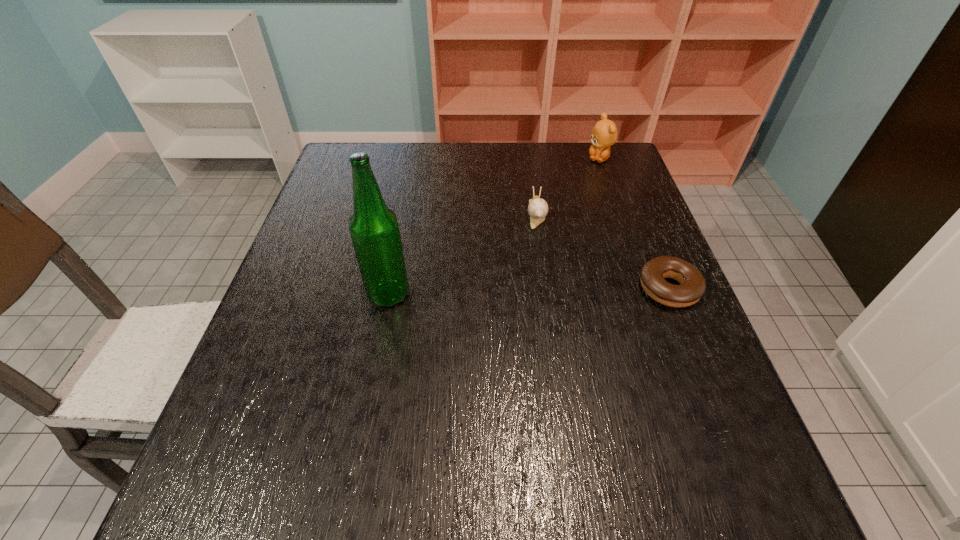
Identify the location of object that is at the far right corner. This screenshot has height=540, width=960. (604, 134).

You are a GUI agent. You are given a task and a screenshot of the screen. Output one action in this format:
    pyautogui.click(x=<x>, y=<y>)
    Task: Click on the vacant area at the far edge of the desktop
    
    Given the screenshot: What is the action you would take?
    pyautogui.click(x=391, y=155)

Identify the location of vacant region at the left edge of the desktop. (311, 232).

In the image, there is a desktop. What are the coordinates of `vacant region at the right edge` in the screenshot? It's located at (609, 285).

You are a GUI agent. You are given a task and a screenshot of the screen. Output one action in this format:
    pyautogui.click(x=<x>, y=<y>)
    Task: Click on the vacant space at the far left corner of the desktop
    
    Given the screenshot: What is the action you would take?
    pyautogui.click(x=373, y=145)

Identify the location of vacant space at the near left corner. This screenshot has height=540, width=960. (299, 419).

Locate an element on the screen. This screenshot has width=960, height=540. free space between the third shortest object and the escargot is located at coordinates (567, 186).

Where is `free space between the tallest object and the second farthest object`? The width and height of the screenshot is (960, 540). free space between the tallest object and the second farthest object is located at coordinates (463, 254).

I want to click on vacant point located between the beer bottle and the second farthest object, so (x=463, y=254).

Where is `vacant space that is in between the leftmost object and the second object from left to right`? Image resolution: width=960 pixels, height=540 pixels. vacant space that is in between the leftmost object and the second object from left to right is located at coordinates (463, 254).